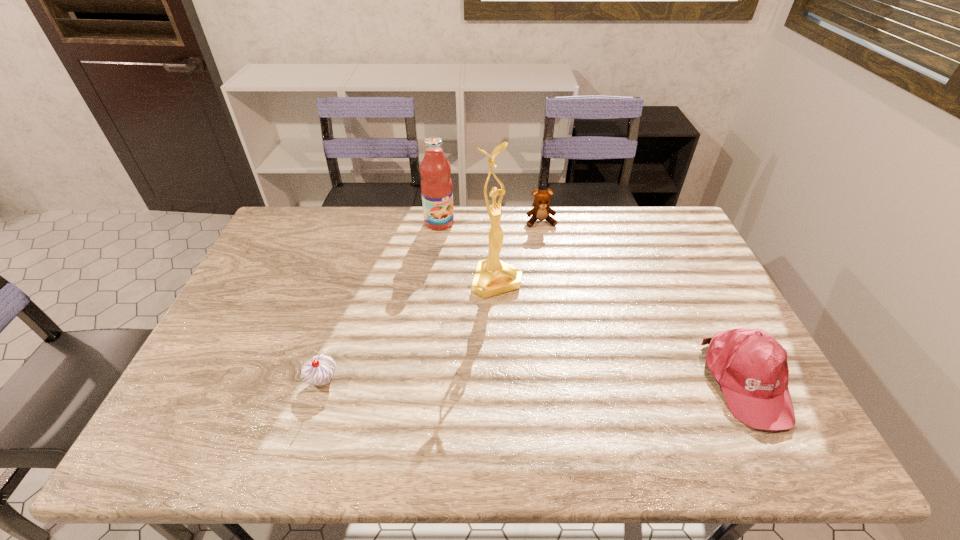
At what (x,y) coordinates should I click in order to perform the action: click on baseball cap located at the near edge. Please return your answer as a coordinate pair (x, y). Image resolution: width=960 pixels, height=540 pixels. Looking at the image, I should click on (751, 367).

Where is `object that is at the right edge`? Image resolution: width=960 pixels, height=540 pixels. object that is at the right edge is located at coordinates (751, 367).

Identify the location of object present at the near right corner. The height and width of the screenshot is (540, 960). (751, 367).

You are a GUI agent. You are given a task and a screenshot of the screen. Output one action in this format:
    pyautogui.click(x=<x>, y=<y>)
    Task: Click on the vacant area at the far edge of the desktop
    This screenshot has height=540, width=960.
    Given the screenshot: What is the action you would take?
    [x=555, y=235]

At what (x,y) coordinates should I click in order to perform the action: click on vacant space at the near edge of the desktop. Please return your answer as a coordinate pair (x, y). The width and height of the screenshot is (960, 540). Looking at the image, I should click on (300, 392).

Locate an element on the screen. free space at the left edge of the desktop is located at coordinates click(254, 280).

The height and width of the screenshot is (540, 960). I want to click on vacant point at the right edge, so click(x=706, y=306).

Locate an element on the screen. The height and width of the screenshot is (540, 960). free space at the far left corner of the desktop is located at coordinates (290, 211).

Locate an element on the screen. This screenshot has height=540, width=960. blank space at the near left corner is located at coordinates (208, 391).

The width and height of the screenshot is (960, 540). What are the coordinates of `unoccupied area between the third nearest object and the rightmost object` in the screenshot? It's located at (622, 331).